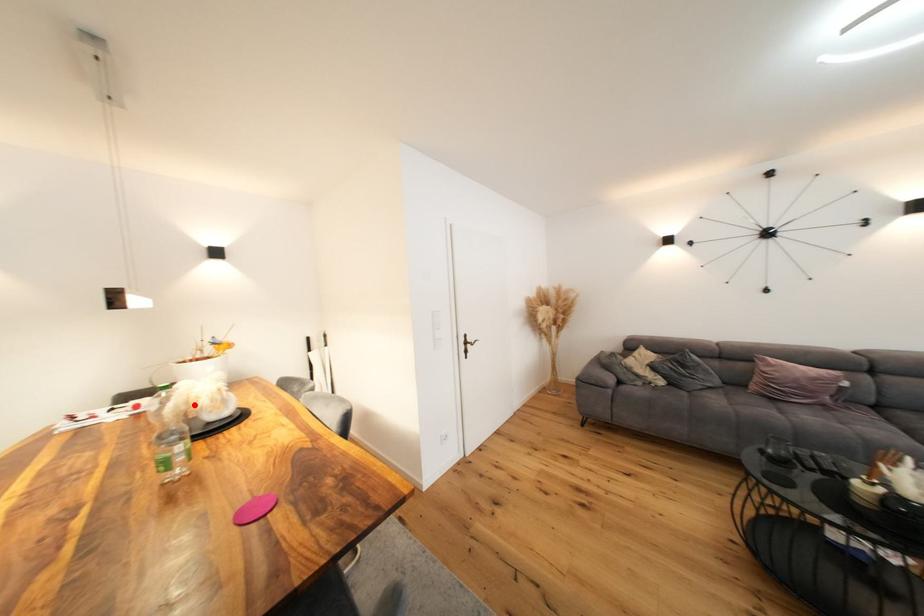
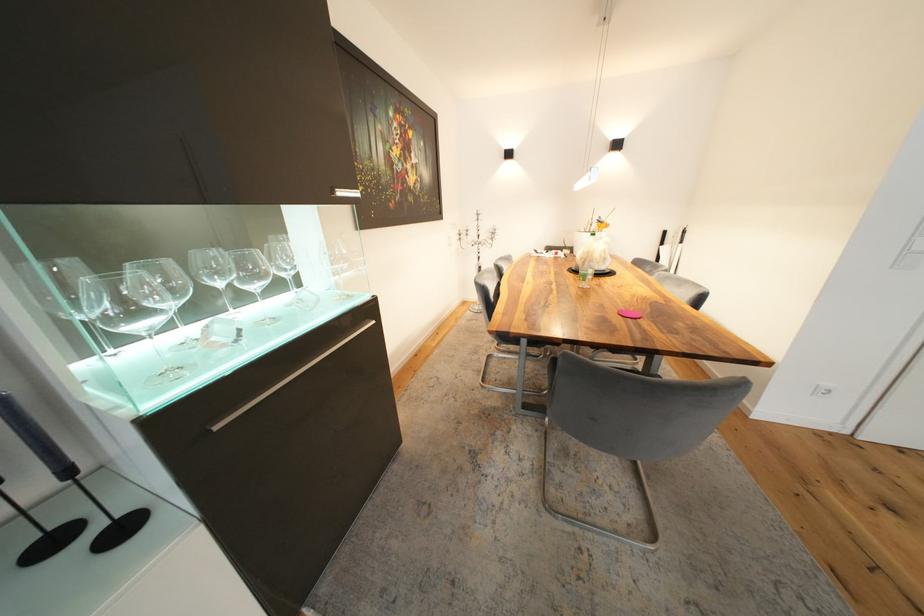
Locate, in the second image, the point that corresponds to the highlighted location in the first image.

(594, 254)